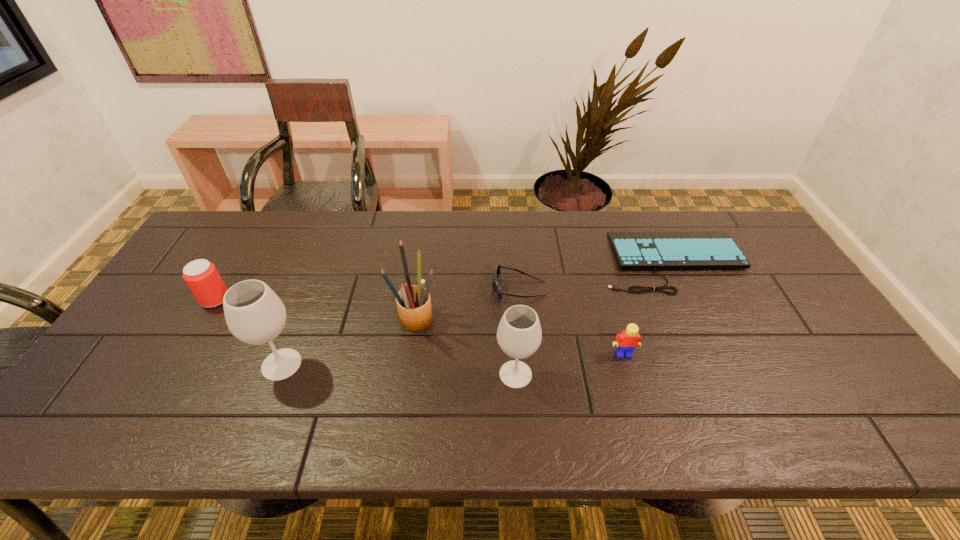
The height and width of the screenshot is (540, 960). Identify the location of empty space between the shorter wineglass and the leftmost object. (365, 336).

At what (x,y) coordinates should I click in order to perform the action: click on vacant space that's between the taller wineglass and the right wineglass. Please return your answer as a coordinate pair (x, y). Looking at the image, I should click on pyautogui.click(x=398, y=369).

At what (x,y) coordinates should I click in order to perform the action: click on free space between the taller wineglass and the Lego. Please return your answer as a coordinate pair (x, y). Looking at the image, I should click on (452, 359).

Select which object is the fifth closest to the leftmost object. Please provide its 2D coordinates. Your answer should be formatted as a tuple, i.e. [(x, y)], where the tuple contains the x and y coordinates of a point satisfying the conditions above.

[(627, 341)]

The width and height of the screenshot is (960, 540). I want to click on the sixth closest object to the sixth object from right to left, so click(705, 249).

You are a GUI agent. You are given a task and a screenshot of the screen. Output one action in this format:
    pyautogui.click(x=<x>, y=<y>)
    Task: Click on the vacant area that satisfies the following two spatial constraints: 1. on the front side of the third object from left to right; 2. on the left side of the leftmost object
    
    Given the screenshot: What is the action you would take?
    click(x=204, y=319)

Find the location of a particular element. The image size is (960, 540). vacant space that satisfies the following two spatial constraints: 1. on the back side of the third object from left to right; 2. on the right side of the left wineglass is located at coordinates (300, 319).

Where is `blank area in the image that satisfies the following two spatial constraints: 1. on the back side of the second object from left to right; 2. on the right side of the pencil box`? The height and width of the screenshot is (540, 960). blank area in the image that satisfies the following two spatial constraints: 1. on the back side of the second object from left to right; 2. on the right side of the pencil box is located at coordinates (300, 319).